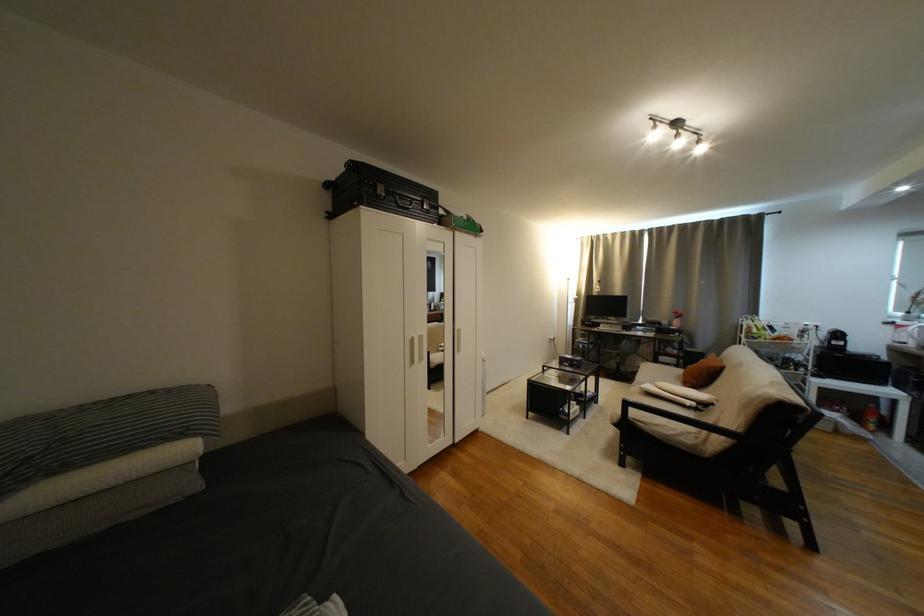
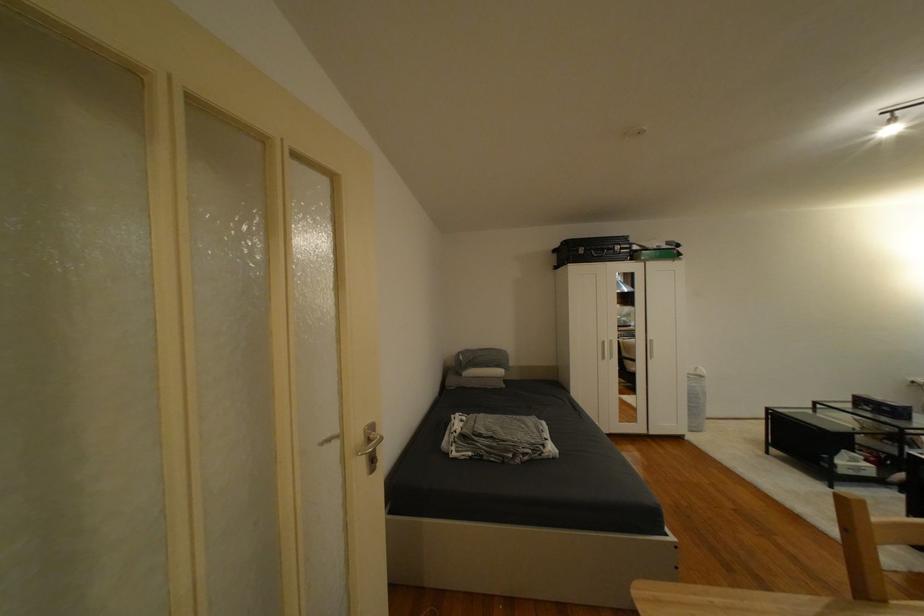
The point at (342, 200) is marked in the first image. Where is the corresponding point in the second image?

(565, 257)